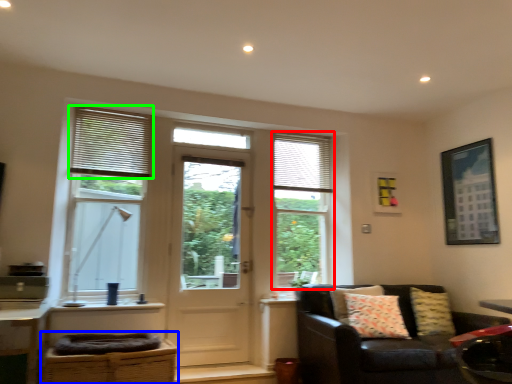
Question: Based on their relative distances, which object is farther from window (highlighted by a red box)? Choose from swivel chair (highlighted by a blue box) and window blind (highlighted by a green box).

Choices:
 (A) swivel chair
 (B) window blind

Answer: (A)